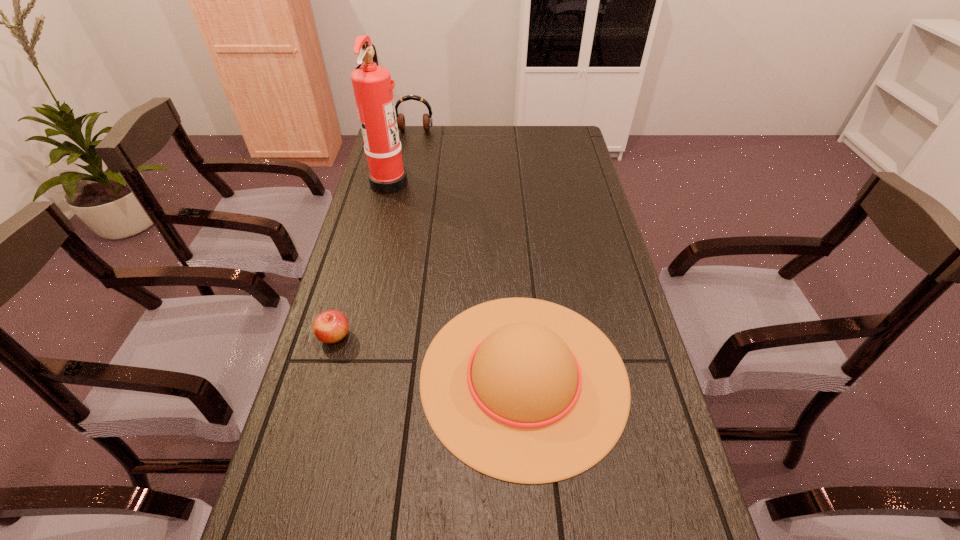
Image resolution: width=960 pixels, height=540 pixels. I want to click on vacant space situated on the front of the apple, so click(315, 404).

At what (x,y) coordinates should I click in order to perform the action: click on object that is at the far edge. Please return your answer as a coordinate pair (x, y). The image size is (960, 540). Looking at the image, I should click on (427, 119).

Identify the location of fire extinguisher situated at the left edge. (372, 84).

Where is `headset positioned at the left edge`? headset positioned at the left edge is located at coordinates (427, 119).

This screenshot has width=960, height=540. I want to click on apple located in the left edge section of the desktop, so click(331, 326).

Image resolution: width=960 pixels, height=540 pixels. Identify the location of object present at the right edge. (523, 390).

The width and height of the screenshot is (960, 540). Find the location of `object present at the far left corner`. object present at the far left corner is located at coordinates (427, 119).

You are a GUI agent. You are given a task and a screenshot of the screen. Output one action in this format:
    pyautogui.click(x=<x>, y=<y>)
    Task: Click on the vacant region at the far edge of the desktop
    The image size is (960, 540).
    Given the screenshot: What is the action you would take?
    pyautogui.click(x=490, y=131)

The image size is (960, 540). In the image, there is a desktop. Find the location of `vacant space at the left edge`. vacant space at the left edge is located at coordinates (373, 192).

Where is `vacant point at the right edge`? The height and width of the screenshot is (540, 960). vacant point at the right edge is located at coordinates (674, 522).